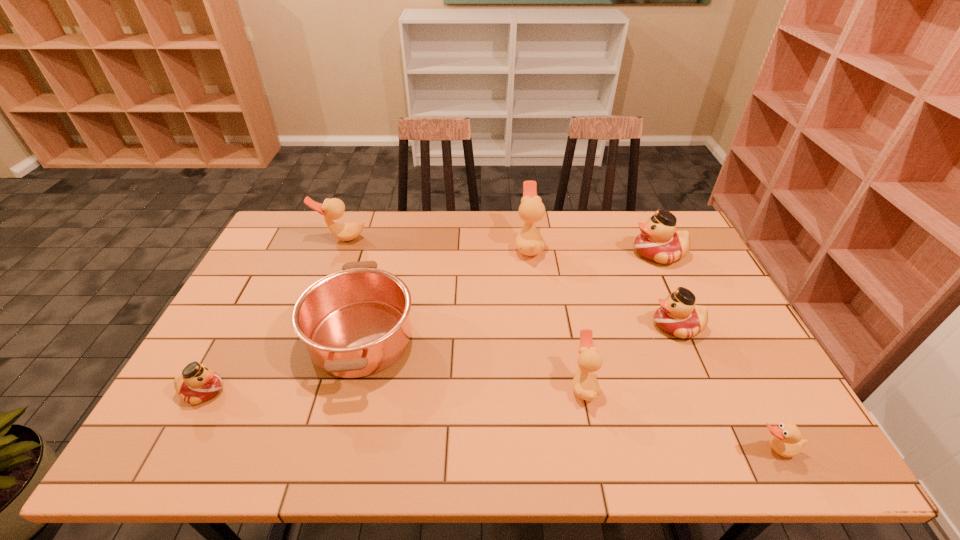
I want to click on object positioned at the far left corner, so click(x=332, y=209).

Find the location of a particular element. This screenshot has width=960, height=540. object present at the far right corner is located at coordinates (658, 242).

Image resolution: width=960 pixels, height=540 pixels. What are the coordinates of `object that is at the near right corner` in the screenshot? It's located at (787, 441).

In order to click on blank space at the far edge in this screenshot , I will do `click(547, 215)`.

Identify the location of vacant space at the near edge. (604, 428).

You are a GUI agent. You are given a task and a screenshot of the screen. Output one action in this format:
    pyautogui.click(x=<x>, y=<y>)
    Task: Click on the vacant space at the left edge of the desktop
    This screenshot has width=960, height=540.
    Given the screenshot: What is the action you would take?
    click(x=287, y=261)

The height and width of the screenshot is (540, 960). In the image, there is a desktop. Find the location of `free region at the right edge`. free region at the right edge is located at coordinates (654, 262).

What are the coordinates of `free area in between the smallest tan duck and the nearest red duck` in the screenshot? It's located at (489, 420).

Find the location of a particular element. This screenshot has width=960, height=540. vacant point located between the leftmost duck and the third biggest tan duck is located at coordinates (394, 388).

This screenshot has width=960, height=540. I want to click on vacant region between the second tan duck from right to left and the biggest red duck, so click(621, 320).